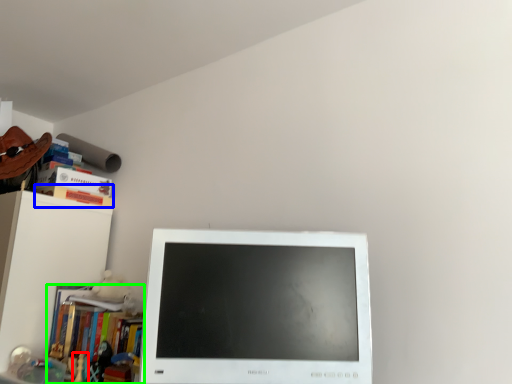
Question: Estimate the real-world distances between objects in this image. Which object is farther from toy (highlighted by a red box), paperback book (highlighted by a blue box) or book (highlighted by a green box)?

Choices:
 (A) paperback book
 (B) book

Answer: (A)